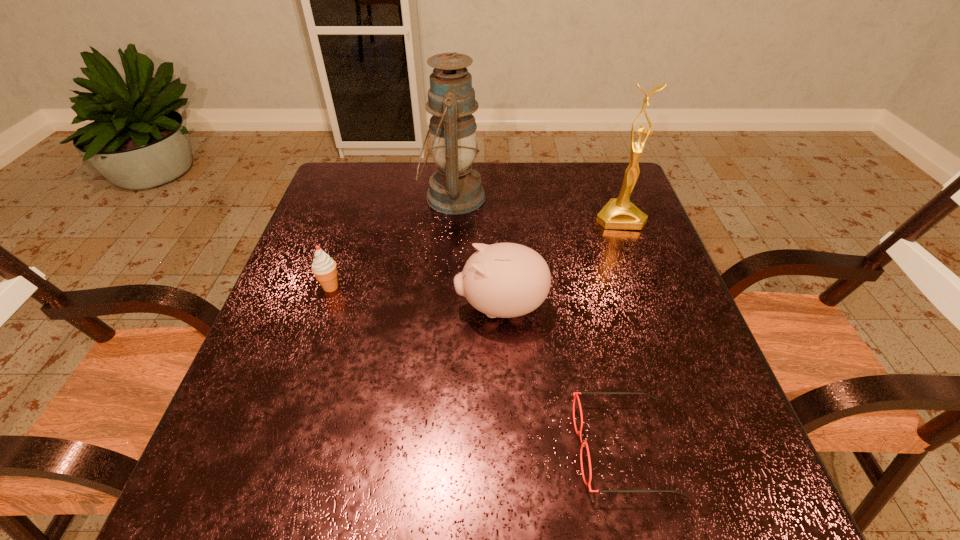
Locate an element on the screen. This screenshot has height=540, width=960. award present at the right edge is located at coordinates click(x=619, y=213).

Locate an element on the screen. The image size is (960, 540). spectacles located at the right edge is located at coordinates (575, 394).

Locate an element on the screen. The image size is (960, 540). object situated at the far right corner is located at coordinates (619, 213).

Locate an element on the screen. object at the near right corner is located at coordinates (575, 394).

The image size is (960, 540). Identify the location of free point at the far edge. (505, 164).

Locate an element on the screen. The height and width of the screenshot is (540, 960). vacant region at the near edge of the desktop is located at coordinates (619, 483).

In the image, there is a desktop. At what (x,y) coordinates should I click in order to perform the action: click on free space at the left edge. Please return your answer as a coordinate pair (x, y). This screenshot has width=960, height=540. Looking at the image, I should click on (337, 330).

Where is `blank space at the right edge of the desktop`? blank space at the right edge of the desktop is located at coordinates (736, 450).

At what (x,y) coordinates should I click in order to perform the action: click on free space at the near left corner of the desktop. Please return your answer as a coordinate pair (x, y). The width and height of the screenshot is (960, 540). Looking at the image, I should click on (236, 475).

In the image, there is a desktop. Where is `vacant space at the far right corner`? vacant space at the far right corner is located at coordinates (608, 175).